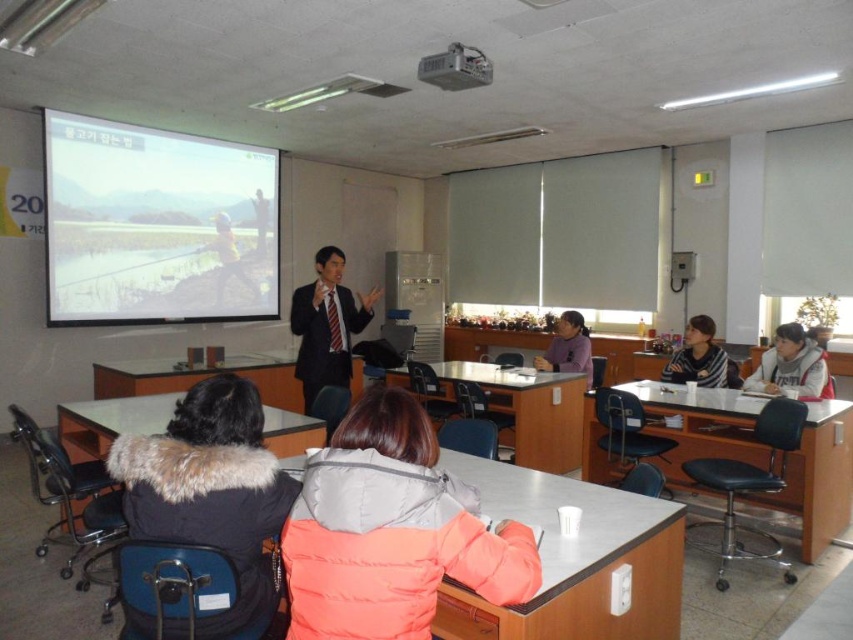
Is fur-lined coat at lower left positioned behind white fleece jacket at lower right?

No.

Is fur-lined coat at lower left bigger than white fleece jacket at lower right?

No, fur-lined coat at lower left is not bigger than white fleece jacket at lower right.

You are a GUI agent. You are given a task and a screenshot of the screen. Output one action in this format:
    pyautogui.click(x=<x>, y=<y>)
    Task: Click on the fur-lined coat at lower left
    This screenshot has height=640, width=853.
    Given the screenshot: What is the action you would take?
    pyautogui.click(x=212, y=490)

Where is `fur-lined coat at lower left`? fur-lined coat at lower left is located at coordinates (212, 490).

Can you confirm if fur-lined coat at lower left is taller than smooth black table at lower right?

No, fur-lined coat at lower left is not taller than smooth black table at lower right.

Between fur-lined coat at lower left and smooth black table at lower right, which one is positioned lower?

smooth black table at lower right is lower down.

You are a GUI agent. You are given a task and a screenshot of the screen. Output one action in this format:
    pyautogui.click(x=<x>, y=<y>)
    Task: Click on the fur-lined coat at lower left
    
    Given the screenshot: What is the action you would take?
    coord(212,490)

Is white glossy table at center above white glossy table at lower left?

Indeed, white glossy table at center is positioned over white glossy table at lower left.

Is white glossy table at center shorter than white glossy table at lower left?

No.

This screenshot has width=853, height=640. Find the location of `white glossy table at center`. white glossy table at center is located at coordinates (526, 410).